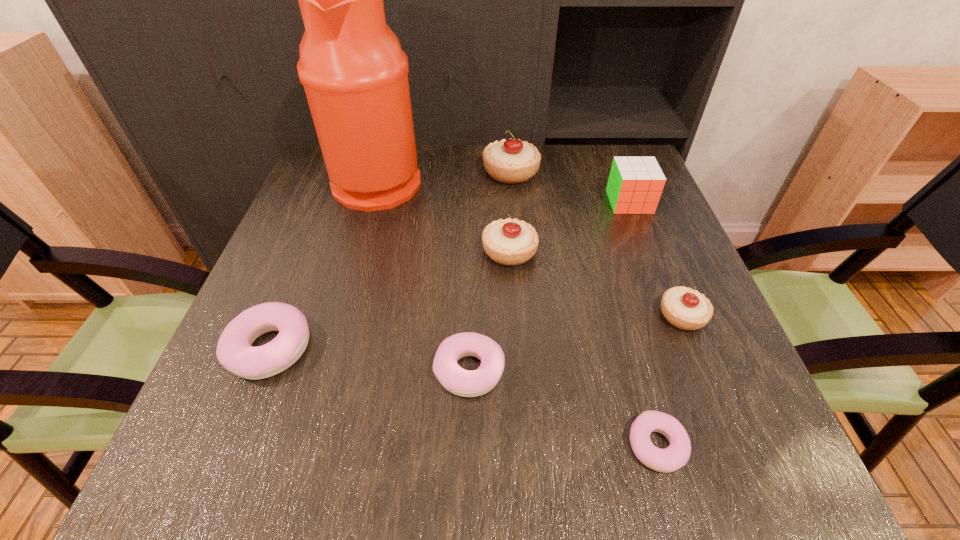
This screenshot has height=540, width=960. Find the location of `the biggest pink pastry`. the biggest pink pastry is located at coordinates (234, 351).

Locate an element on the screen. This screenshot has width=960, height=540. the second smallest pink pastry is located at coordinates pyautogui.click(x=461, y=382).

Locate an element on the screen. the second shortest pastry is located at coordinates (461, 382).

Where is `the shortest pastry`? the shortest pastry is located at coordinates (676, 455).

I want to click on the smallest pink pastry, so click(x=676, y=455).

Identify the location of vacant space located 0.290m from the spout of the orange water jug. (534, 180).

The width and height of the screenshot is (960, 540). I want to click on free point located on the front of the farthest beige pastry, so click(x=521, y=291).

Where is `vacant position located 0.160m on the left of the cube`? vacant position located 0.160m on the left of the cube is located at coordinates coord(544,202).

Locate an element on the screen. The width and height of the screenshot is (960, 540). vacant region located 0.320m on the left of the second nearest beige pastry is located at coordinates (x=334, y=252).

Where is `free location located on the front of the nearest beige pastry`? free location located on the front of the nearest beige pastry is located at coordinates (700, 359).